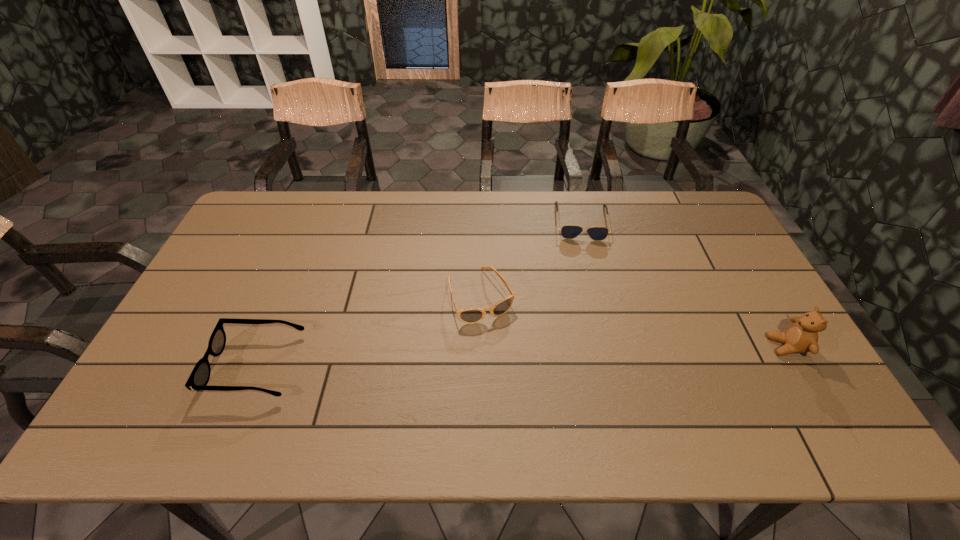
This screenshot has height=540, width=960. Identify the location of object that is the third closest to the left sunglasses. (801, 337).

Identify the location of the third closest object to the second object from right to left. The width and height of the screenshot is (960, 540). (199, 377).

What are the coordinates of `blank space that satisfies the following two spatial constraints: 1. on the front side of the rightmost object; 2. on the front-facing side of the nearer sunglasses` in the screenshot? It's located at (481, 346).

Find the location of a particular element. This screenshot has height=540, width=960. vacant space that satisfies the following two spatial constraints: 1. on the front side of the teddy bear; 2. on the front-facing side of the second object from right to left is located at coordinates (612, 346).